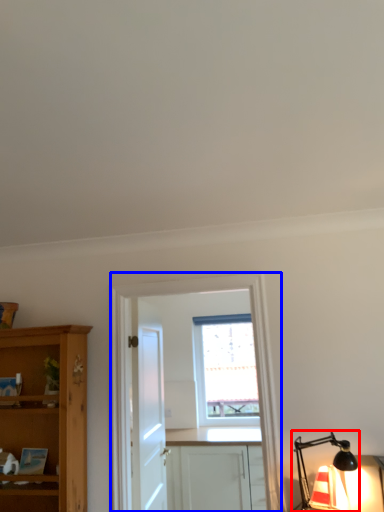
Question: Which of the following is the closest to the observer, light fixture (highlighted by a red box) or entertainment center (highlighted by a blue box)?

Choices:
 (A) light fixture
 (B) entertainment center

Answer: (A)